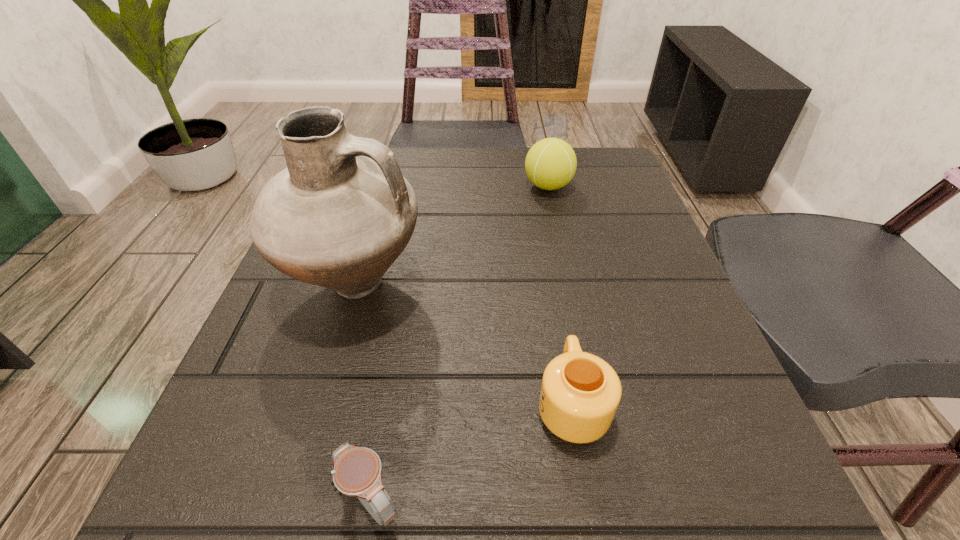
Where is `the tallest object`? The height and width of the screenshot is (540, 960). the tallest object is located at coordinates (338, 216).

The height and width of the screenshot is (540, 960). In order to click on pitcher in this screenshot , I will do `click(338, 216)`.

The width and height of the screenshot is (960, 540). Find the location of `tennis ball`. tennis ball is located at coordinates (550, 164).

Where is `the farthest object`? the farthest object is located at coordinates (550, 164).

Locate an element on the screen. The width and height of the screenshot is (960, 540). mug is located at coordinates (580, 393).

At what (x,y) coordinates should I click in order to perform the action: click on the nearest object. Please return your answer as a coordinate pair (x, y). The height and width of the screenshot is (540, 960). Looking at the image, I should click on (357, 471).

Identify the location of free space located 0.330m on the handle side of the second farthest object. [x=630, y=286].

Find the location of a particular element. free space located 0.110m on the left of the second tallest object is located at coordinates (471, 186).

This screenshot has height=540, width=960. What are the coordinates of `free region located 0.090m on the handle side of the mug` in the screenshot? It's located at [x=557, y=316].

I want to click on vacant region located on the handle side of the mug, so click(550, 280).